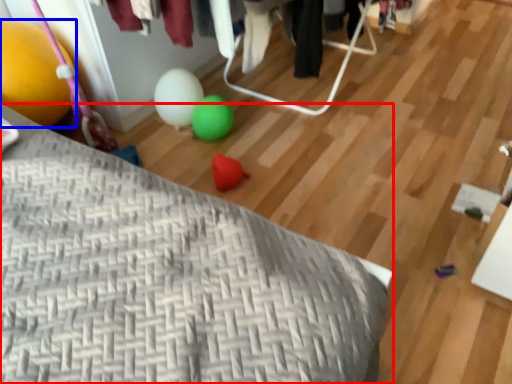
Question: Which point is further to the camera, furniture (highlighted by a red box) or balloon (highlighted by a blue box)?

Choices:
 (A) furniture
 (B) balloon

Answer: (B)